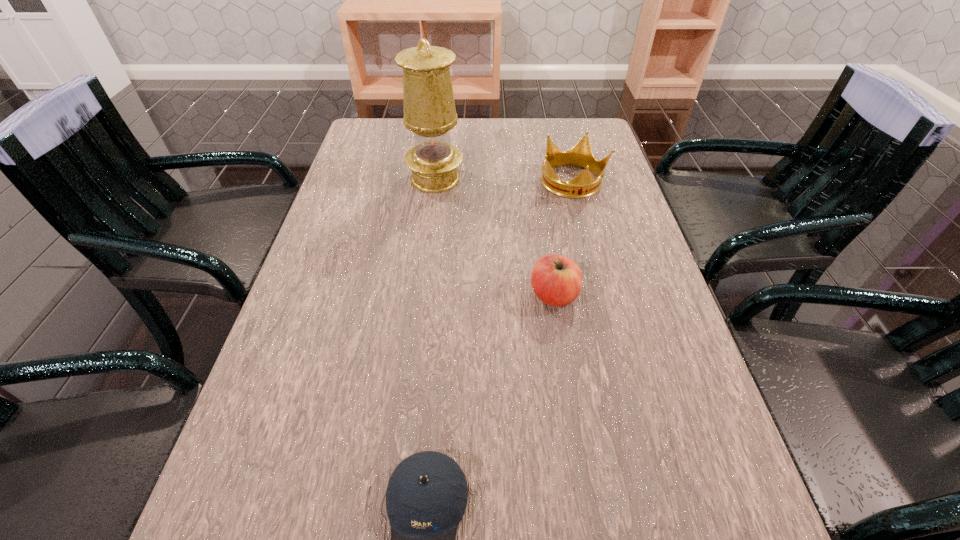
In the image, there is a desktop. Identify the location of blank space at the far left corner. The width and height of the screenshot is (960, 540). (394, 137).

I want to click on vacant region between the tallest object and the crown, so click(x=504, y=180).

Locate an element on the screen. Image resolution: width=960 pixels, height=540 pixels. vacant space that is in between the apple and the crown is located at coordinates (564, 239).

You are a GUI agent. You are given a task and a screenshot of the screen. Output one action in this format:
    pyautogui.click(x=<x>, y=<y>)
    Task: Click on the unoccupied position between the apple and the oil lamp
    The width and height of the screenshot is (960, 540).
    Given the screenshot: What is the action you would take?
    pyautogui.click(x=494, y=238)

This screenshot has width=960, height=540. I want to click on unoccupied area between the apple and the crown, so click(x=564, y=239).

Find the location of `object that is the second closest one to the third farthest object`. object that is the second closest one to the third farthest object is located at coordinates (427, 493).

Select which object is the second closest to the tallest object. Please provide its 2D coordinates. Your answer should be formatted as a tuple, i.e. [(x, y)], where the tuple contains the x and y coordinates of a point satisfying the conditions above.

[(556, 280)]

Image resolution: width=960 pixels, height=540 pixels. I want to click on vacant space that satisfies the following two spatial constraints: 1. on the back side of the crown; 2. on the left side of the apple, so coord(536,182).